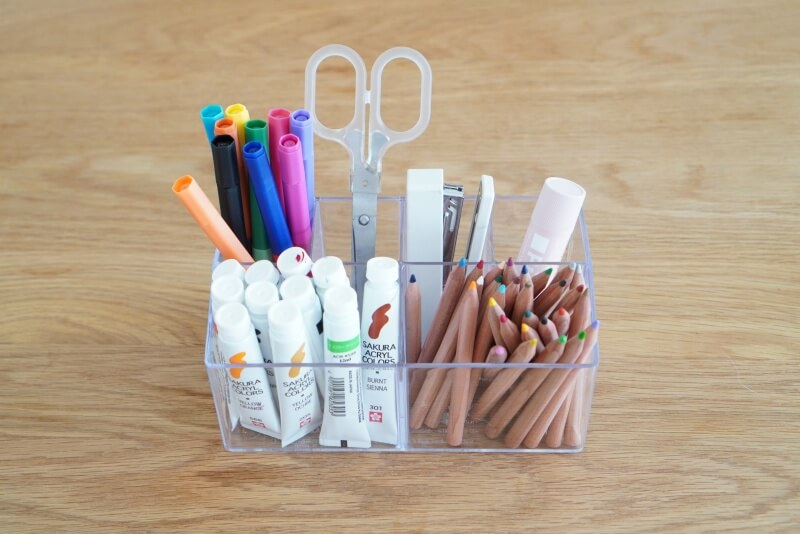
Identify the location of markers. (189, 189), (225, 161), (225, 125), (210, 109), (232, 112), (256, 122), (256, 168), (296, 168), (282, 119), (290, 119).